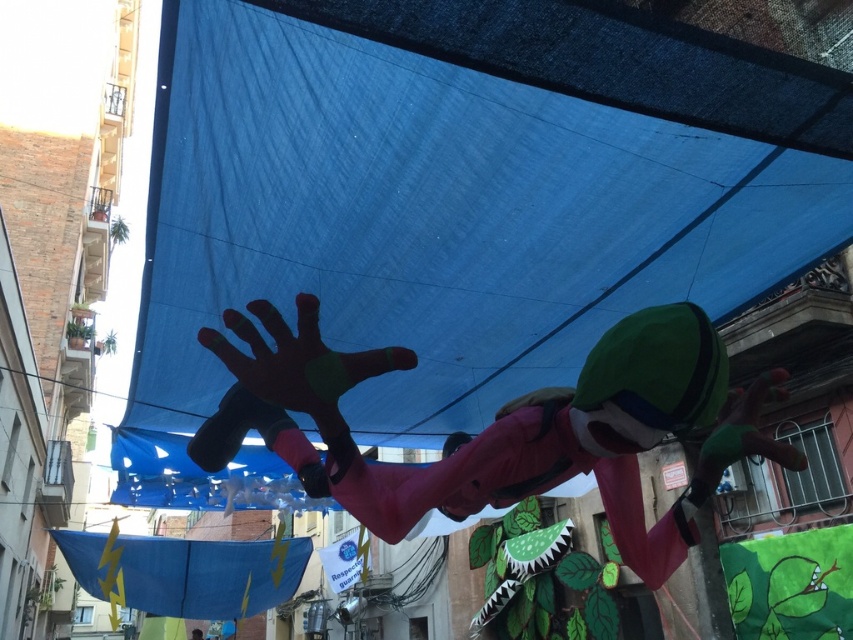
Question: Which object is closer to the camera taking this photo?

Choices:
 (A) pink matte fabric at center
 (B) blue tarpaulin at center

Answer: (B)

Question: Does blue tarpaulin at center have a smaller size compared to pink matte fabric at center?

Choices:
 (A) no
 (B) yes

Answer: (A)

Question: Can you confirm if blue tarpaulin at center is positioned above pink matte fabric at center?

Choices:
 (A) no
 (B) yes

Answer: (B)

Question: From the image, what is the correct spatial relationship of blue tarpaulin at center in relation to pink matte fabric at center?

Choices:
 (A) left
 (B) right

Answer: (A)

Question: Which object is farther from the camera taking this photo?

Choices:
 (A) blue tarpaulin at center
 (B) pink matte fabric at center

Answer: (B)